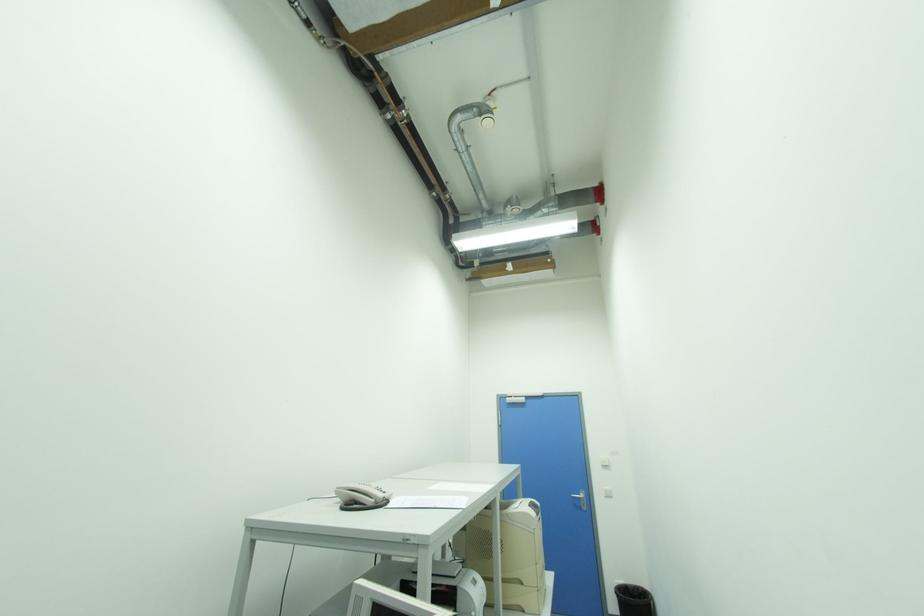
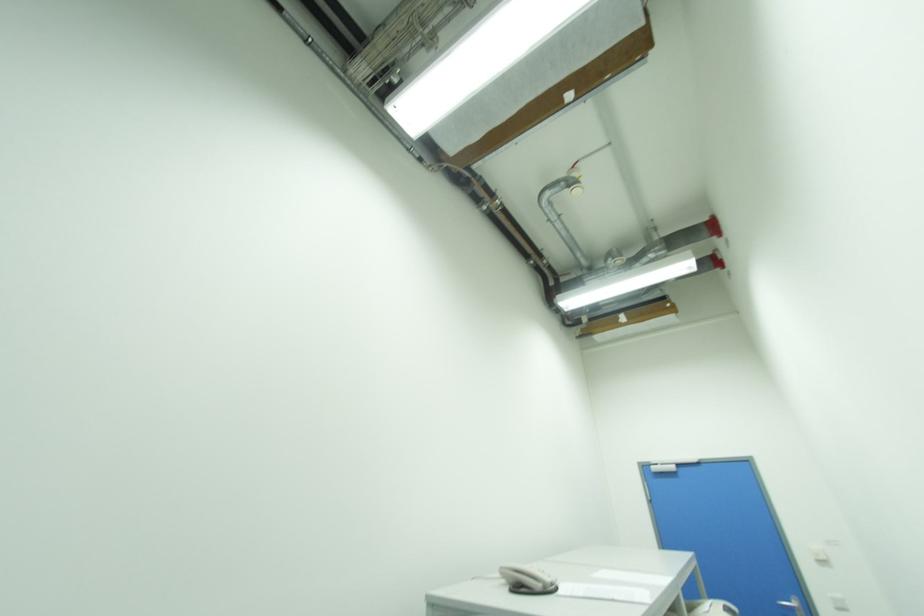
Question: The camera is either moving clockwise (left) or counter-clockwise (right) around the object. The first image is from the beginning of the video and the second image is from the end. Is the camera moving left or right when shooting the video?

Choices:
 (A) Left
 (B) Right

Answer: (B)